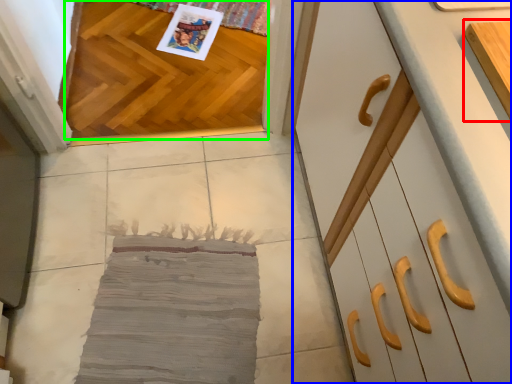
Question: Based on their relative distances, which object is nearer to cabinetry (highlighted by a red box)? Choose from cabinetry (highlighted by a blue box) and hardwood (highlighted by a green box).

Choices:
 (A) cabinetry
 (B) hardwood

Answer: (A)